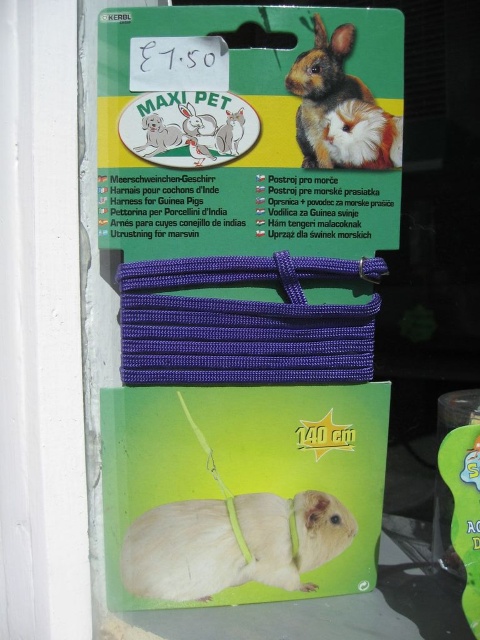
You are a customer at a pet store looking at the MAXI PET harness packaging. You see a white matte hamster at center and a fluffy brown hamster at upper right. Which hamster on the packaging is bigger?

The white matte hamster at center is larger in size compared to the fluffy brown hamster at upper right.

You are a pet store employee who needs to place the white matte hamster at center and the fluffy brown hamster at upper right into cages. The cages have height restrictions. Which hamster requires a taller cage due to its size?

The fluffy brown hamster at upper right requires a taller cage because it is taller than the white matte hamster at center.